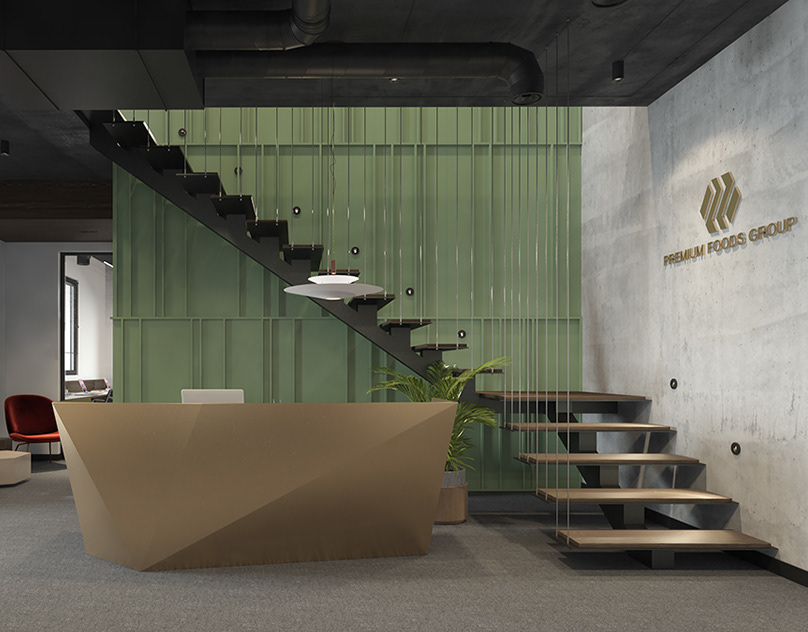
Identify the location of cement wall. This screenshot has height=632, width=808. (735, 313).